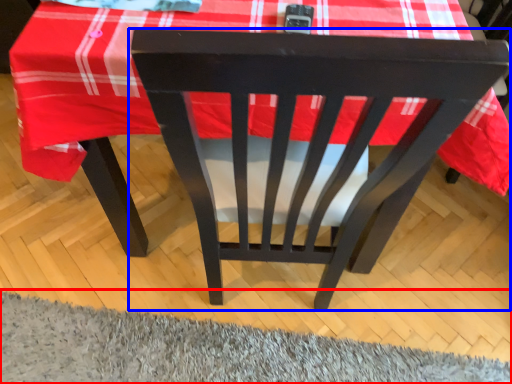
Question: Which of the following is the farthest to the observer, mat (highlighted by a red box) or chair (highlighted by a blue box)?

Choices:
 (A) mat
 (B) chair

Answer: (B)